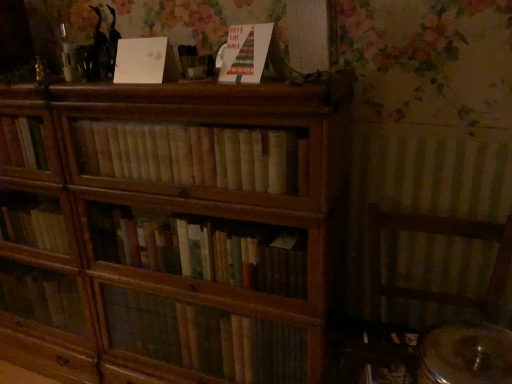
Question: Does light brown wooden books at center have a larger size compared to white matte paper at upper center, the 2th paperback book when ordered from right to left?

Choices:
 (A) yes
 (B) no

Answer: (A)

Question: Can you confirm if light brown wooden books at center is thinner than white matte paper at upper center, the 2th paperback book when ordered from right to left?

Choices:
 (A) yes
 (B) no

Answer: (B)

Question: Is light brown wooden books at center not close to white matte paper at upper center, the 2th paperback book when ordered from right to left?

Choices:
 (A) yes
 (B) no

Answer: (B)

Question: From the image's perspective, would you say light brown wooden books at center is shown under white matte paper at upper center, the first paperback book when ordered from left to right?

Choices:
 (A) yes
 (B) no

Answer: (A)

Question: Is light brown wooden books at center shorter than white matte paper at upper center, the first paperback book when ordered from left to right?

Choices:
 (A) no
 (B) yes

Answer: (A)

Question: Considering the positions of white matte paper at upper center, the first paperback book when ordered from left to right, and matte paper card at upper center, which is the 2th paperback book in left-to-right order, in the image, is white matte paper at upper center, the first paperback book when ordered from left to right, wider or thinner than matte paper card at upper center, which is the 2th paperback book in left-to-right order,?

Choices:
 (A) wide
 (B) thin

Answer: (B)

Question: From the image's perspective, is white matte paper at upper center, the first paperback book when ordered from left to right, located above or below matte paper card at upper center, which is the 2th paperback book in left-to-right order?

Choices:
 (A) below
 (B) above

Answer: (B)

Question: From a real-world perspective, is white matte paper at upper center, the 2th paperback book when ordered from right to left, above or below matte paper card at upper center, the first paperback book from the right?

Choices:
 (A) below
 (B) above

Answer: (A)

Question: Based on their positions, is white matte paper at upper center, the first paperback book when ordered from left to right, located to the left or right of matte paper card at upper center, the first paperback book from the right?

Choices:
 (A) right
 (B) left

Answer: (B)

Question: Is light brown wooden books at center situated inside matte paper card at upper center, which is the 2th paperback book in left-to-right order, or outside?

Choices:
 (A) outside
 (B) inside

Answer: (A)

Question: Considering the positions of light brown wooden books at center and matte paper card at upper center, the first paperback book from the right, in the image, is light brown wooden books at center taller or shorter than matte paper card at upper center, the first paperback book from the right,?

Choices:
 (A) short
 (B) tall

Answer: (B)

Question: Is light brown wooden books at center wider or thinner than matte paper card at upper center, the first paperback book from the right?

Choices:
 (A) thin
 (B) wide

Answer: (B)

Question: Considering the positions of light brown wooden books at center and matte paper card at upper center, which is the 2th paperback book in left-to-right order, in the image, is light brown wooden books at center bigger or smaller than matte paper card at upper center, which is the 2th paperback book in left-to-right order,?

Choices:
 (A) big
 (B) small

Answer: (A)

Question: From the image's perspective, is white matte paper at upper center, the 2th paperback book when ordered from right to left, above or below light brown wooden books at center?

Choices:
 (A) above
 (B) below

Answer: (A)

Question: Looking at their shapes, would you say white matte paper at upper center, the first paperback book when ordered from left to right, is wider or thinner than light brown wooden books at center?

Choices:
 (A) wide
 (B) thin

Answer: (B)